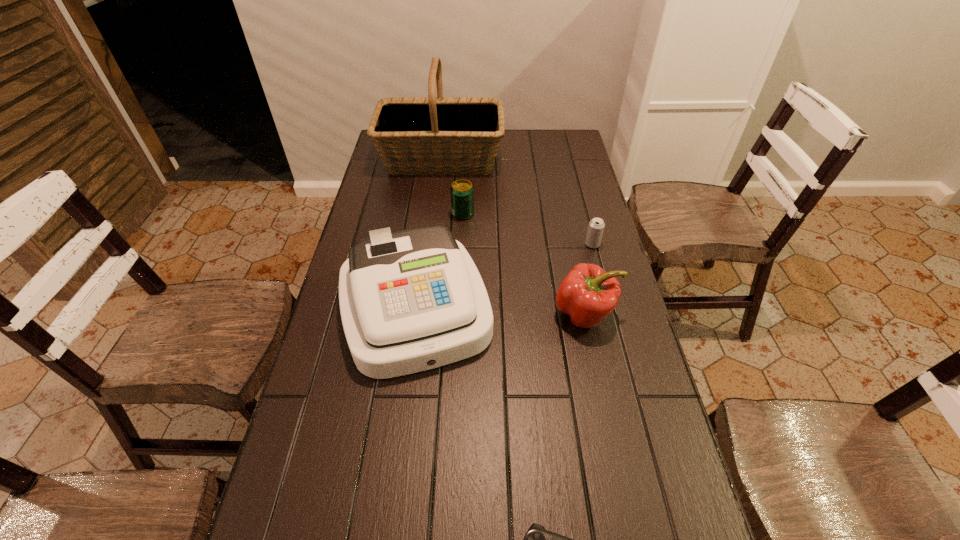
The image size is (960, 540). I want to click on free space located 0.250m on the front of the fourth shortest object, so click(609, 428).

At what (x,y) coordinates should I click in order to perform the action: click on free space located 0.170m on the left of the second farthest object. Please return your answer as a coordinate pair (x, y). The width and height of the screenshot is (960, 540). Looking at the image, I should click on (402, 214).

The image size is (960, 540). What are the coordinates of `free space located 0.140m on the back of the nearer beer can` in the screenshot? It's located at (584, 213).

Where is `object situated at the far edge`? The width and height of the screenshot is (960, 540). object situated at the far edge is located at coordinates (431, 135).

In order to click on basket present at the left edge in this screenshot , I will do (431, 135).

The image size is (960, 540). Find the location of `cash register at the left edge`. cash register at the left edge is located at coordinates (412, 300).

Identify the location of pepper that is at the right edge. The image size is (960, 540). 587,294.

What are the coordinates of `beer can present at the right edge` in the screenshot? It's located at (596, 226).

This screenshot has width=960, height=540. I want to click on object located at the far left corner, so click(x=431, y=135).

At what (x,y) coordinates should I click in order to perform the action: click on free region at the far edge. Please return your answer as a coordinate pair (x, y). The width and height of the screenshot is (960, 540). Looking at the image, I should click on (508, 159).